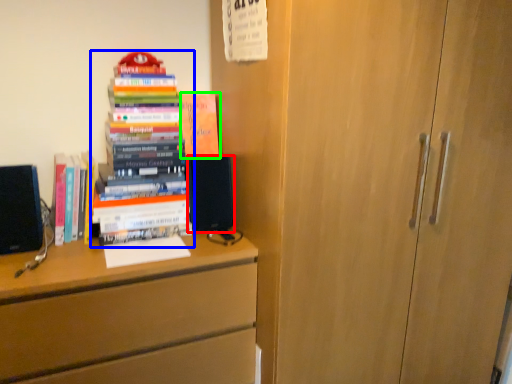
Question: Which object is the closest to the speaker (highlighted by a red box)? Choose among these: book (highlighted by a blue box) or book (highlighted by a green box).

Choices:
 (A) book
 (B) book

Answer: (A)